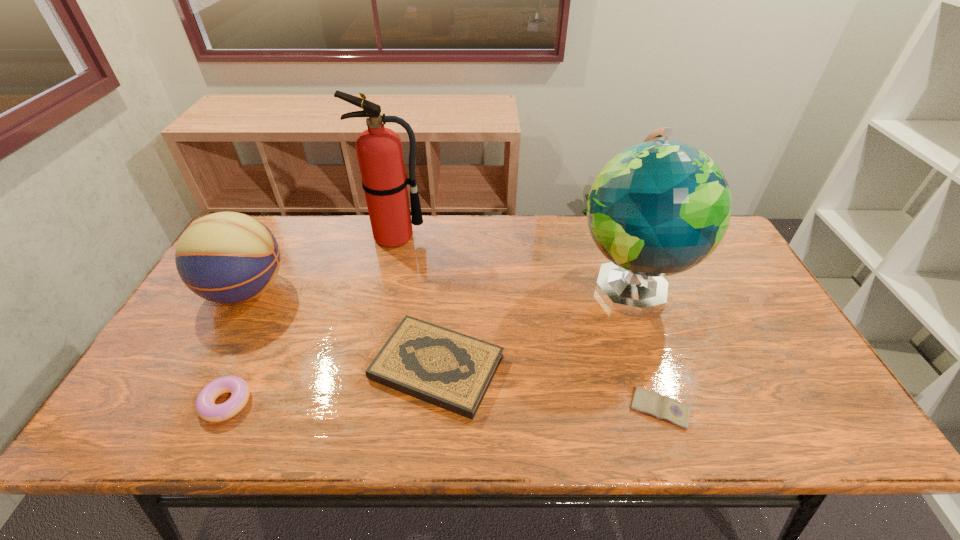
Find the location of a particular element. This screenshot has height=540, width=960. vacant region located on the back of the hardback book is located at coordinates (444, 278).

Where is `vacant region located on the back of the diary`? Image resolution: width=960 pixels, height=540 pixels. vacant region located on the back of the diary is located at coordinates (627, 308).

Where is `fire extinguisher present at the far edge`? fire extinguisher present at the far edge is located at coordinates (379, 150).

Find the location of a particular element. globe present at the far edge is located at coordinates (659, 208).

Locate an element on the screen. doughnut that is at the near edge is located at coordinates (205, 406).

Image resolution: width=960 pixels, height=540 pixels. I want to click on hardback book that is at the near edge, so click(451, 370).

At what (x,y) coordinates should I click in order to perform the action: click on diary located in the near edge section of the desktop. Please return your answer as a coordinate pair (x, y). The width and height of the screenshot is (960, 540). Looking at the image, I should click on (652, 403).

Locate an element on the screen. Image resolution: width=960 pixels, height=540 pixels. object that is at the left edge is located at coordinates (226, 257).

This screenshot has height=540, width=960. What are the coordinates of `free region at the far edge` in the screenshot? It's located at pyautogui.click(x=528, y=235).

Locate an element on the screen. free spot at the right edge of the desktop is located at coordinates (766, 357).